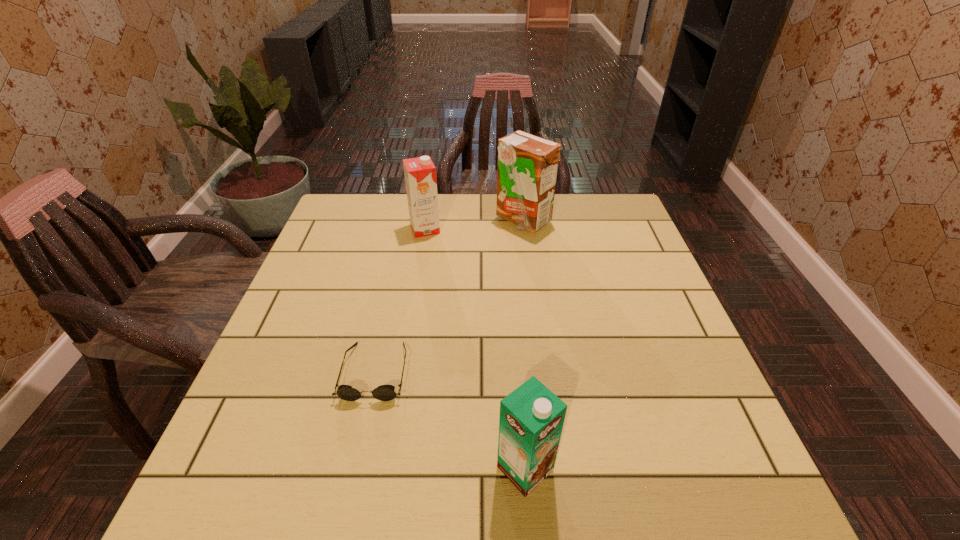
The image size is (960, 540). I want to click on the leftmost carton, so click(420, 173).

Find the location of `the nearest carton`. the nearest carton is located at coordinates (531, 420).

The width and height of the screenshot is (960, 540). I want to click on the third farthest object, so click(384, 392).

Identify the location of sunglasses. The height and width of the screenshot is (540, 960). (384, 392).

The width and height of the screenshot is (960, 540). I want to click on vacant space located 0.170m on the left of the leftmost carton, so tap(353, 229).

Image resolution: width=960 pixels, height=540 pixels. Find the location of `free space located on the right of the nearest carton`. free space located on the right of the nearest carton is located at coordinates (592, 469).

What are the coordinates of `free space located on the front-facing side of the sunglasses` in the screenshot? It's located at (359, 444).

Where is `object that is positioned at the near edge`? The height and width of the screenshot is (540, 960). object that is positioned at the near edge is located at coordinates (531, 420).

What are the coordinates of `free space at the far edge` in the screenshot? It's located at (389, 212).

The image size is (960, 540). I want to click on free region at the near edge of the desktop, so click(414, 483).